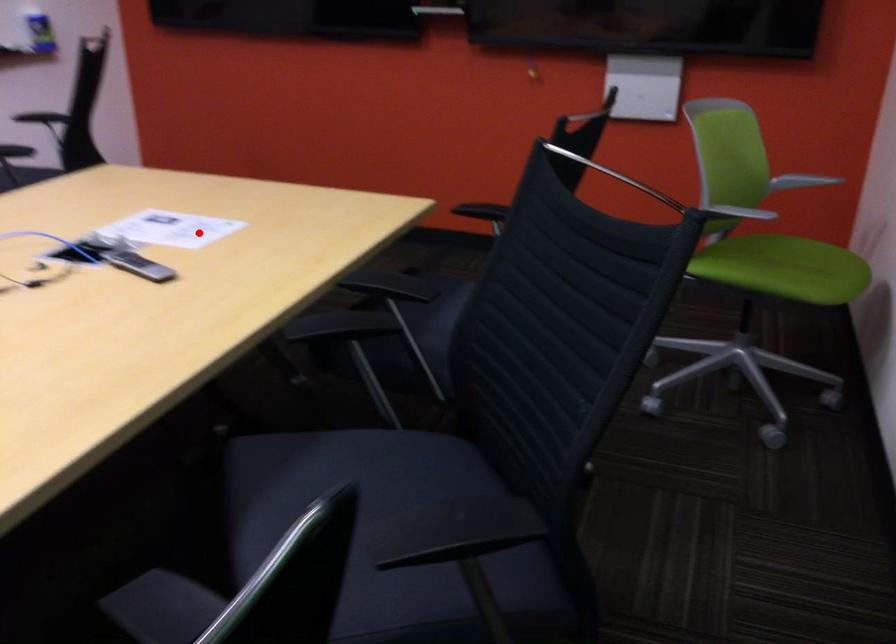
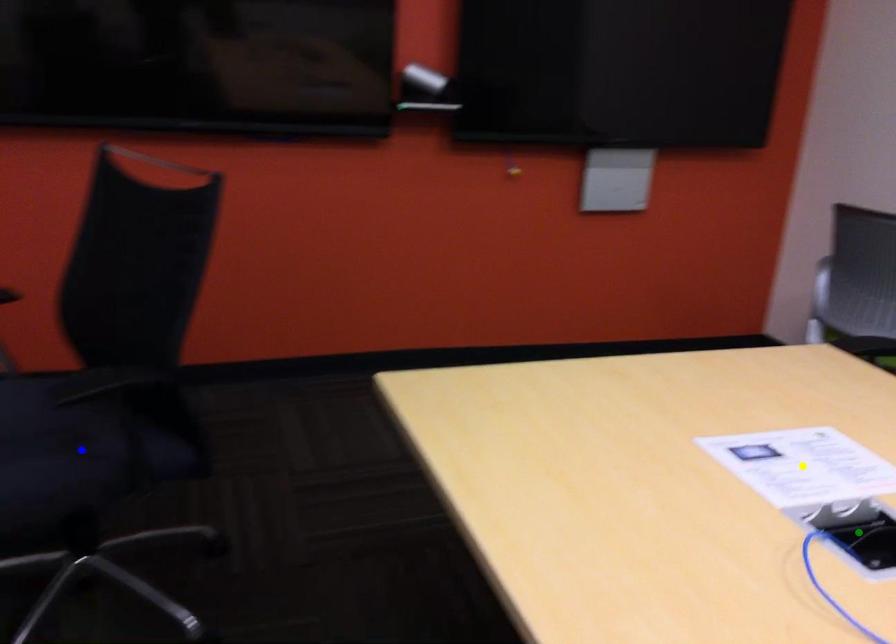
Question: I am providing you with two images of the same scene from different viewpoints. A red point is marked on the first image. You are given multiple points on the second image. Which spot in image 2 lines up with the point in image 1?

Choices:
 (A) yellow point
 (B) blue point
 (C) green point

Answer: (A)